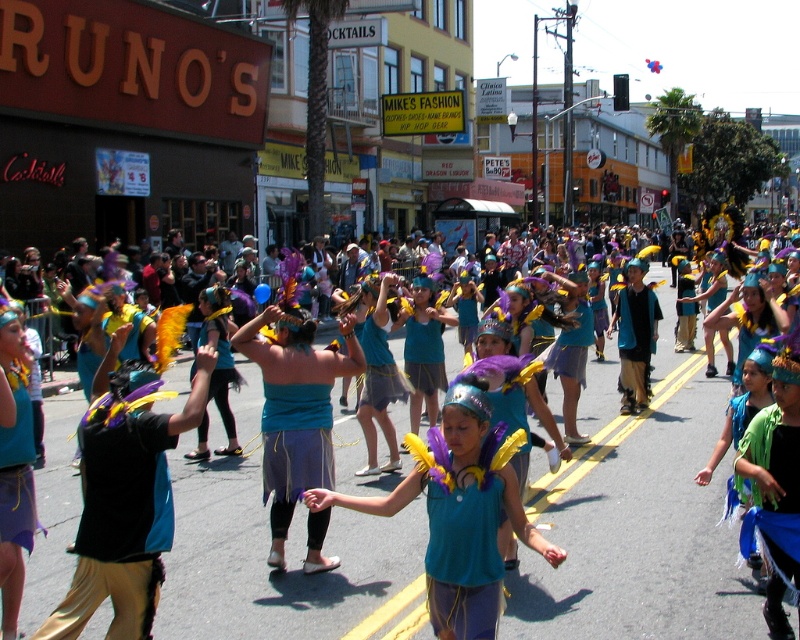
You are a costume designer observing the parade. You need to determine which piece of clothing is longer between the matte teal tank top at center and the blue fabric skirt at center. Which one is longer?

The blue fabric skirt at center is longer than the matte teal tank top at center according to the description.

You are a photographer trying to capture a closeup of both the blue fabric skirt at center and the teal fabric mask at center. Since you want to ensure both are fully visible in the frame, which object requires a wider angle to accommodate its size?

The blue fabric skirt at center requires a wider angle because its width surpasses that of the teal fabric mask at center.